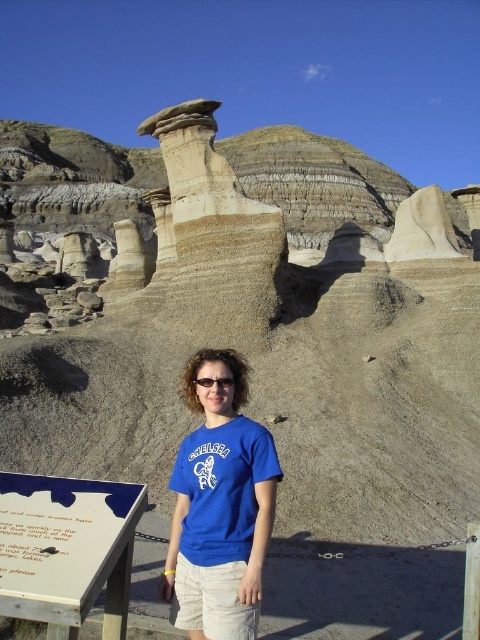
Measure the distance between blue cotton t-shirt at center and camera.

blue cotton t-shirt at center is 62.10 feet away from camera.

Measure the distance between point (x=231, y=621) and camera.

Point (x=231, y=621) is 63.21 feet from camera.

This screenshot has height=640, width=480. I want to click on blue cotton t-shirt at center, so click(219, 506).

Does blue cotton t-shirt at center appear under white wood sign at lower left?

Incorrect, blue cotton t-shirt at center is not positioned below white wood sign at lower left.

Is point (180, 541) less distant than point (123, 548)?

That is False.

Where is `blue cotton t-shirt at center`? blue cotton t-shirt at center is located at coordinates (219, 506).

Can you confirm if white wood sign at lower left is positioned below transparent plastic goggles at center?

Indeed, white wood sign at lower left is positioned under transparent plastic goggles at center.

Image resolution: width=480 pixels, height=640 pixels. I want to click on white wood sign at lower left, so 66,547.

Between point (12, 518) and point (218, 381), which one is positioned in front?

Positioned in front is point (12, 518).

In order to click on white wood sign at lower left in this screenshot , I will do click(x=66, y=547).